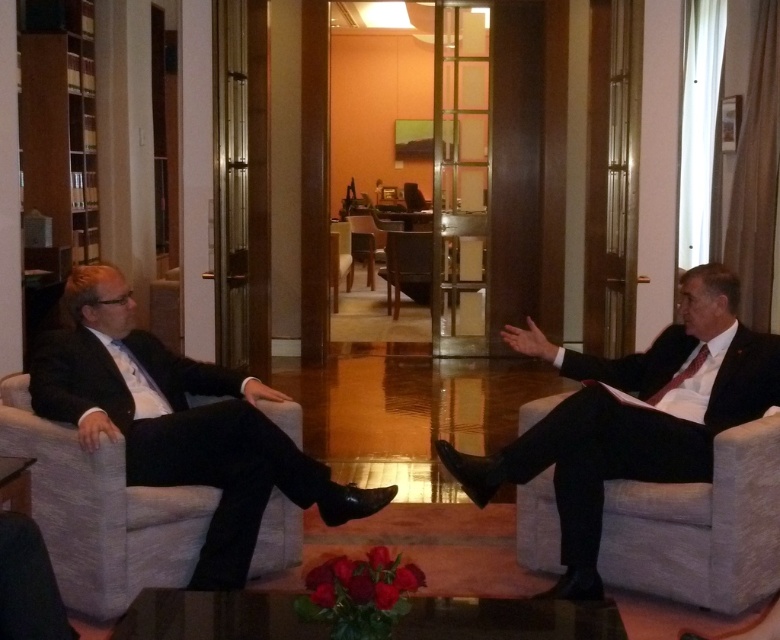
Does point (385, 278) come in front of point (373, 285)?

Yes, it is in front of point (373, 285).

Is wooden textured chair at center to the left of wooden chair at center from the viewer's perspective?

In fact, wooden textured chair at center is to the right of wooden chair at center.

Where is `wooden textured chair at center`? wooden textured chair at center is located at coordinates tap(406, 268).

Where is `wooden textured chair at center`? This screenshot has height=640, width=780. wooden textured chair at center is located at coordinates (406, 268).

Between matte black suit at left and matte black suit at right, which one has more height?

Standing taller between the two is matte black suit at right.

Between point (91, 282) and point (663, 392), which one is positioned in front?

Point (91, 282) is in front.

This screenshot has width=780, height=640. Find the location of `matte black suit at left`. matte black suit at left is located at coordinates (179, 422).

Is the position of dark gray fabric couch at left less distant than that of wooden textured chair at center?

Yes, it is in front of wooden textured chair at center.

Does dark gray fabric couch at left appear under wooden textured chair at center?

Yes, dark gray fabric couch at left is below wooden textured chair at center.

What do you see at coordinates (101, 513) in the screenshot? I see `dark gray fabric couch at left` at bounding box center [101, 513].

The image size is (780, 640). What are the coordinates of `dark gray fabric couch at left` in the screenshot? It's located at (101, 513).